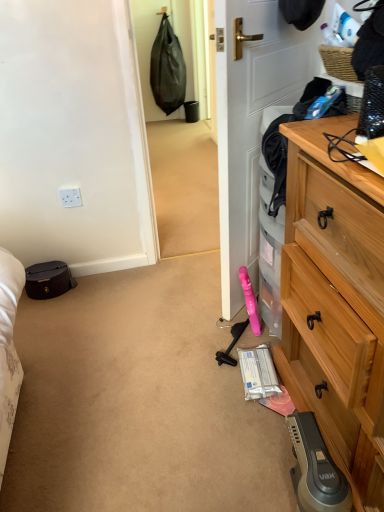
Find the location of a particular element. The width and height of the screenshot is (384, 512). vacant area on top of matte black suitcase at left (from a real-world perspective) is located at coordinates (41, 268).